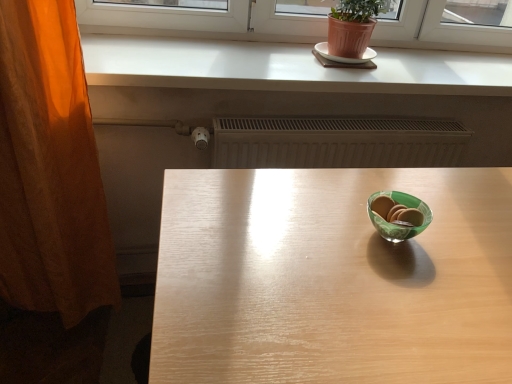
Question: Is point (321, 41) closer or farther from the camera than point (82, 249)?

Choices:
 (A) closer
 (B) farther

Answer: (B)

Question: In terms of height, does white ceramic plate at upper center look taller or shorter compared to orange fabric curtain at left?

Choices:
 (A) short
 (B) tall

Answer: (A)

Question: Which object is positioned farthest from the orange fabric curtain at left?

Choices:
 (A) white ceramic plate at upper center
 (B) white matte counter top at upper center
 (C) light wood table at center

Answer: (A)

Question: Which is farther from the orange fabric curtain at left?

Choices:
 (A) light wood table at center
 (B) white matte counter top at upper center
 (C) white ceramic plate at upper center

Answer: (C)